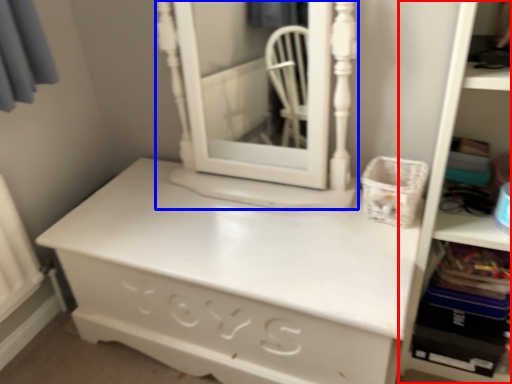
Question: Which point is closer to the camera, bookshelf (highlighted by a red box) or medicine cabinet (highlighted by a blue box)?

Choices:
 (A) bookshelf
 (B) medicine cabinet

Answer: (A)